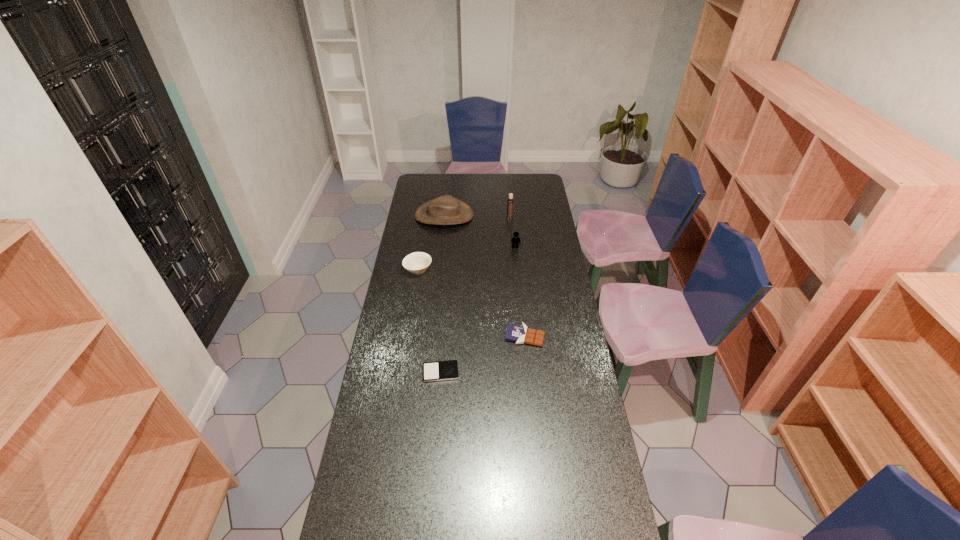
At what (x,y) coordinates should I click in order to perform the action: click on vacant space that's between the Lego and the third shortest object. Please return your answer as a coordinate pair (x, y). This screenshot has height=540, width=960. Looking at the image, I should click on click(467, 259).

In order to click on vacant area that lies between the fifth farthest object and the cowboy hat in this screenshot , I will do `click(485, 276)`.

Locate an element on the screen. object identified as the fifth closest to the cowboy hat is located at coordinates (441, 370).

Identify which object is located as the fourth nearest to the candle holder. Please provide its 2D coordinates. Your answer should be formatted as a tuple, i.e. [(x, y)], where the tuple contains the x and y coordinates of a point satisfying the conditions above.

[(520, 334)]

I want to click on free space that satisfies the following two spatial constraints: 1. on the front side of the fourth tallest object; 2. on the left side of the fifth tallest object, so click(407, 336).

Locate an element on the screen. Image resolution: width=960 pixels, height=540 pixels. free space that satisfies the following two spatial constraints: 1. on the front-facing side of the fourth nearest object; 2. on the right side of the second shortest object is located at coordinates (524, 336).

I want to click on vacant area that satisfies the following two spatial constraints: 1. on the front-facing side of the Lego; 2. on the left side of the second nearest object, so click(x=524, y=336).